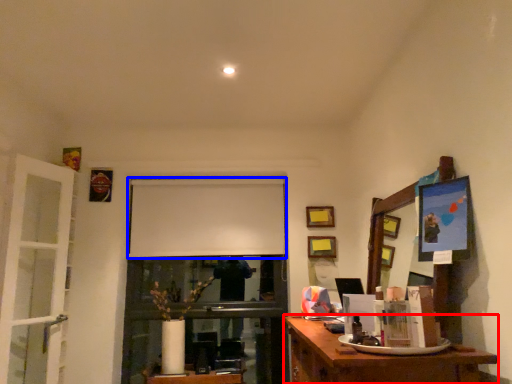
Question: Among these objects, which one is farthest to the camera, desk (highlighted by a red box) or projection screen (highlighted by a blue box)?

Choices:
 (A) desk
 (B) projection screen

Answer: (B)